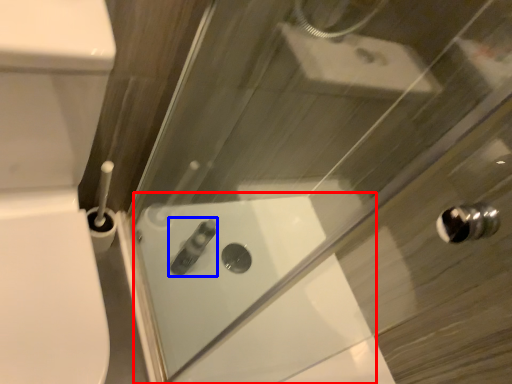
Question: Which object appears closest to the camera in this image, bath (highlighted by a red box) or toiletry (highlighted by a blue box)?

Choices:
 (A) bath
 (B) toiletry

Answer: (A)